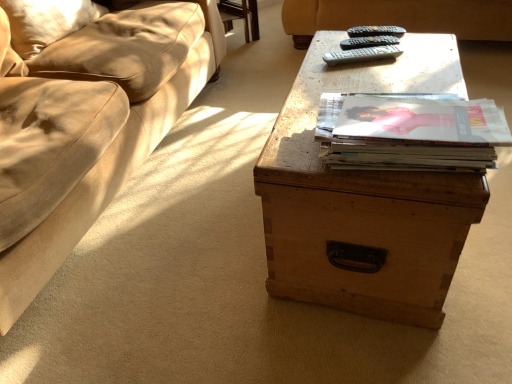
I want to click on vacant area located to the right-hand side of gray plastic remote at upper center, which ranks as the 3th remote in top-to-bottom order, so click(421, 52).